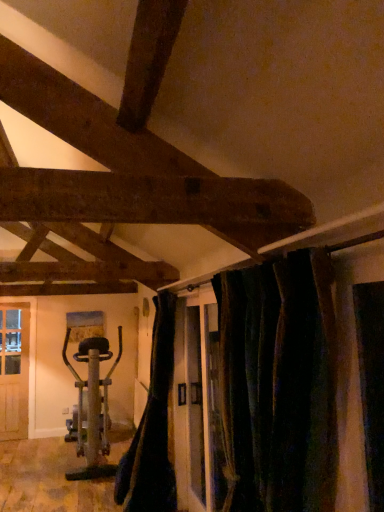
Question: Considering the relative positions of black fabric curtain at lower center, placed as the first curtain when sorted from left to right, and metallic silver exercise bike at left in the image provided, is black fabric curtain at lower center, placed as the first curtain when sorted from left to right, to the right of metallic silver exercise bike at left from the viewer's perspective?

Choices:
 (A) no
 (B) yes

Answer: (B)

Question: Is black fabric curtain at lower center, the second curtain when ordered from front to back, to the left of metallic silver exercise bike at left from the viewer's perspective?

Choices:
 (A) yes
 (B) no

Answer: (B)

Question: Would you say black fabric curtain at lower center, which appears as the second curtain when viewed from the right, contains metallic silver exercise bike at left?

Choices:
 (A) no
 (B) yes

Answer: (A)

Question: From the image's perspective, is black fabric curtain at lower center, the 1th curtain when ordered from back to front, under metallic silver exercise bike at left?

Choices:
 (A) no
 (B) yes

Answer: (A)

Question: Can you see black fabric curtain at lower center, the 1th curtain when ordered from back to front, touching metallic silver exercise bike at left?

Choices:
 (A) yes
 (B) no

Answer: (B)

Question: Considering their positions, is dark velvet curtains at center, the 1th curtain in the right-to-left sequence, located in front of or behind black fabric curtain at lower center, placed as the first curtain when sorted from left to right?

Choices:
 (A) behind
 (B) front

Answer: (B)

Question: Which is correct: dark velvet curtains at center, which is the 1th curtain from front to back, is inside black fabric curtain at lower center, the 1th curtain when ordered from back to front, or outside of it?

Choices:
 (A) inside
 (B) outside

Answer: (B)

Question: Considering the positions of dark velvet curtains at center, which ranks as the 2th curtain in left-to-right order, and black fabric curtain at lower center, placed as the first curtain when sorted from left to right, in the image, is dark velvet curtains at center, which ranks as the 2th curtain in left-to-right order, wider or thinner than black fabric curtain at lower center, placed as the first curtain when sorted from left to right,?

Choices:
 (A) wide
 (B) thin

Answer: (B)

Question: From their relative heights in the image, would you say dark velvet curtains at center, which ranks as the 2th curtain in left-to-right order, is taller or shorter than black fabric curtain at lower center, the 1th curtain when ordered from back to front?

Choices:
 (A) short
 (B) tall

Answer: (A)

Question: Is point [130, 452] positioned closer to the camera than point [74, 374]?

Choices:
 (A) farther
 (B) closer

Answer: (B)

Question: Considering their positions, is black fabric curtain at lower center, placed as the first curtain when sorted from left to right, located in front of or behind metallic silver exercise bike at left?

Choices:
 (A) front
 (B) behind

Answer: (A)

Question: Considering the positions of black fabric curtain at lower center, which appears as the second curtain when viewed from the right, and metallic silver exercise bike at left in the image, is black fabric curtain at lower center, which appears as the second curtain when viewed from the right, bigger or smaller than metallic silver exercise bike at left?

Choices:
 (A) small
 (B) big

Answer: (A)

Question: In terms of width, does black fabric curtain at lower center, the second curtain when ordered from front to back, look wider or thinner when compared to metallic silver exercise bike at left?

Choices:
 (A) thin
 (B) wide

Answer: (A)

Question: From a real-world perspective, relative to black fabric curtain at lower center, placed as the first curtain when sorted from left to right, is metallic silver exercise bike at left vertically above or below?

Choices:
 (A) above
 (B) below

Answer: (B)

Question: Is metallic silver exercise bike at left in front of or behind black fabric curtain at lower center, placed as the first curtain when sorted from left to right, in the image?

Choices:
 (A) behind
 (B) front

Answer: (A)